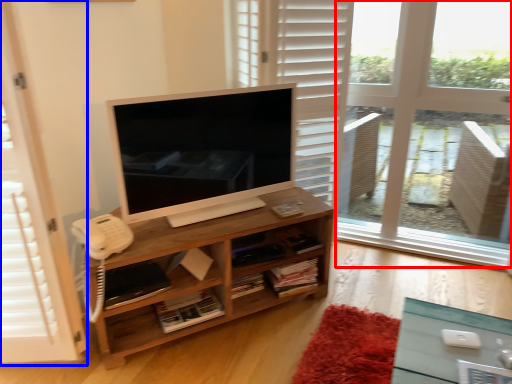
Question: Which of the following is the closest to the observer, window frame (highlighted by a red box) or screen door (highlighted by a blue box)?

Choices:
 (A) window frame
 (B) screen door

Answer: (B)